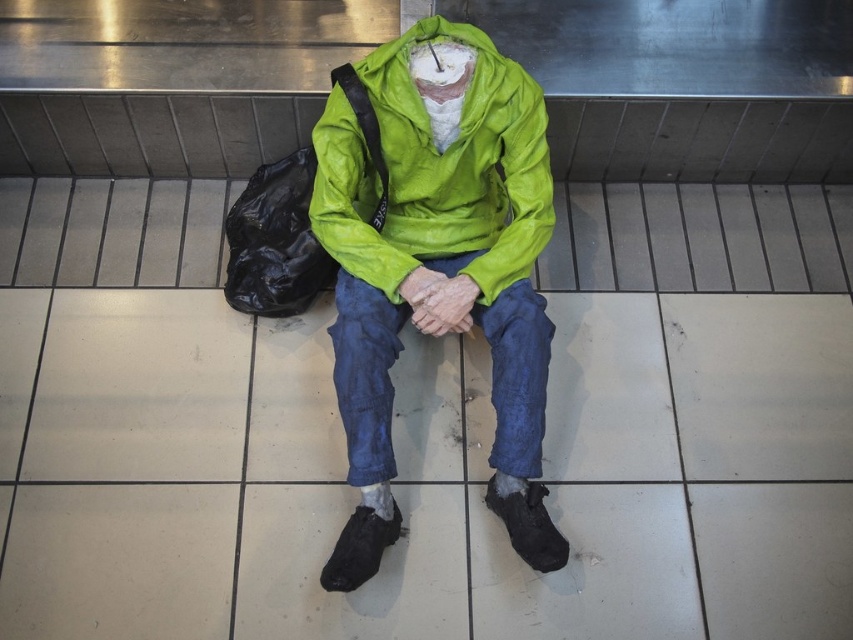
Looking at this image, which of these two, matte green jacket at center or denim at center, stands shorter?

denim at center is shorter.

Is point (540, 406) farther from viewer compared to point (354, 321)?

Yes, point (540, 406) is farther from viewer.

I want to click on matte green jacket at center, so click(438, 266).

Does matte green jacket at center appear on the left side of black plastic bag at lower left?

No, matte green jacket at center is not to the left of black plastic bag at lower left.

Does point (519, 268) come in front of point (276, 237)?

That is True.

Between point (531, 314) and point (233, 257), which one is positioned in front?

Point (531, 314) is more forward.

Locate an element on the screen. This screenshot has height=640, width=853. matte green jacket at center is located at coordinates (438, 266).

Which is more to the right, green tarpaulin jacket at center or denim at center?

Positioned to the right is green tarpaulin jacket at center.

Is the position of green tarpaulin jacket at center less distant than that of denim at center?

Yes, green tarpaulin jacket at center is closer to the viewer.

Is point (491, 97) behind point (338, 328)?

No, (491, 97) is in front of (338, 328).

Identify the location of green tarpaulin jacket at center. The image size is (853, 640). (436, 170).